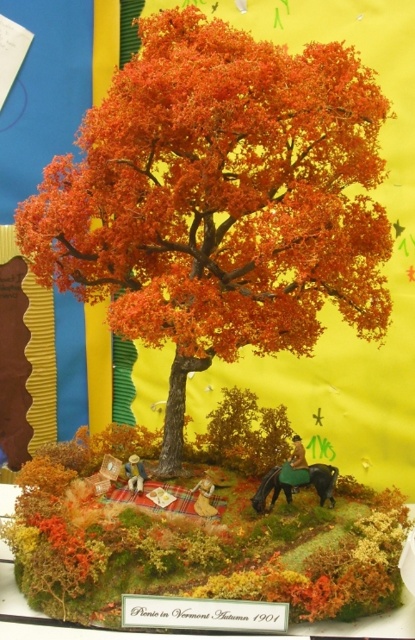
You are a student who wants to place a new miniature bird on the tallest object in the diorama. Which object should you choose between the orange matte tree at center and the green felt horse at center?

The orange matte tree at center is taller than the green felt horse at center, so you should place the miniature bird on the orange matte tree at center.

You are a tiny explorer standing at the edge of the diorama. You want to reach the green felt horse at center without going around the orange matte tree at center. Is it possible to walk directly to the horse?

The orange matte tree at center is in front of the green felt horse at center, so you cannot walk directly to the green felt horse at center without passing behind the tree.